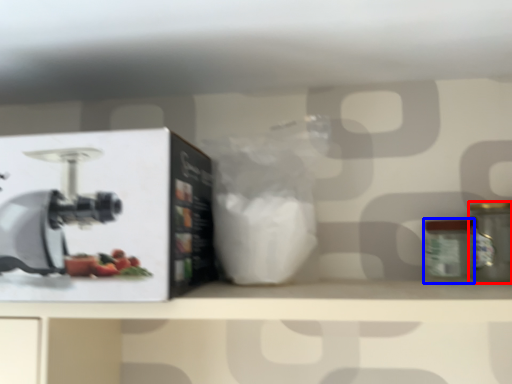
Question: Among these objects, which one is farthest to the camera, kitchen appliance (highlighted by a red box) or glass jar (highlighted by a blue box)?

Choices:
 (A) kitchen appliance
 (B) glass jar

Answer: (B)